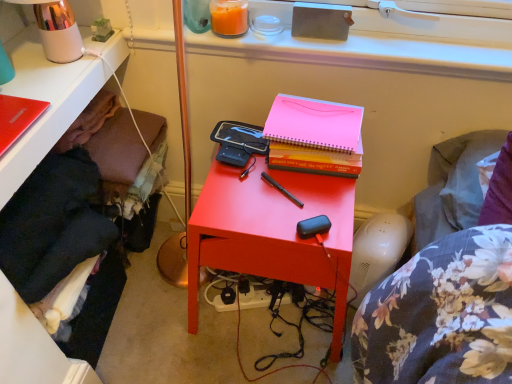
At what (x,y) coordinates should I click in order to perform the action: click on empty space that is ontop of hardcover book at center. Please return your answer as a coordinate pair (x, y). This screenshot has height=384, width=512. Looking at the image, I should click on (313, 114).